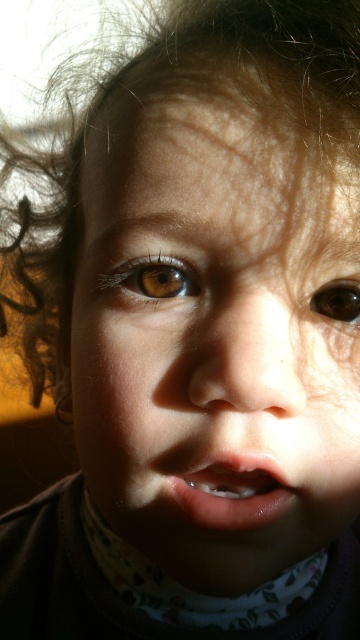
Question: Does smooth skin face at center have a lesser width compared to dark curly hair at upper left?

Choices:
 (A) yes
 (B) no

Answer: (A)

Question: Which point is closer to the camera?

Choices:
 (A) (339, 285)
 (B) (245, 490)
 (C) (182, 262)
 (D) (223, 259)

Answer: (D)

Question: Estimate the real-world distances between objects in this image. Which object is farther from the dark curly hair at upper left?

Choices:
 (A) brown glossy eye at center
 (B) pink glossy lips at center
 (C) smooth skin face at center
 (D) brown matte eye at upper left

Answer: (B)

Question: Can you confirm if smooth skin face at center is positioned below brown glossy eye at center?

Choices:
 (A) no
 (B) yes

Answer: (B)

Question: Does smooth skin face at center have a lesser width compared to brown glossy eye at center?

Choices:
 (A) no
 (B) yes

Answer: (A)

Question: Which object is farther from the camera taking this photo?

Choices:
 (A) pink glossy lips at center
 (B) brown matte eye at upper left

Answer: (B)